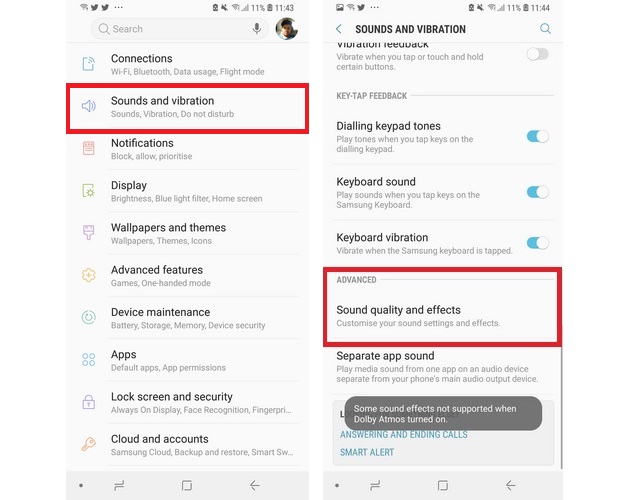
Locate an element on the screen. The width and height of the screenshot is (640, 500). switch thats turned off is located at coordinates (538, 54).